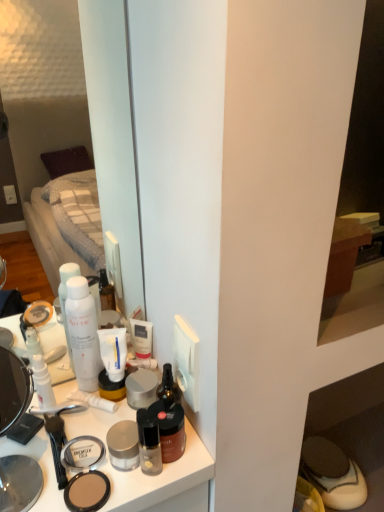
This screenshot has height=512, width=384. Find the location of `vacant space to the left of matte silver jar at center, arranged as the 2th face powder when viewed from the back`. vacant space to the left of matte silver jar at center, arranged as the 2th face powder when viewed from the back is located at coordinates click(44, 448).